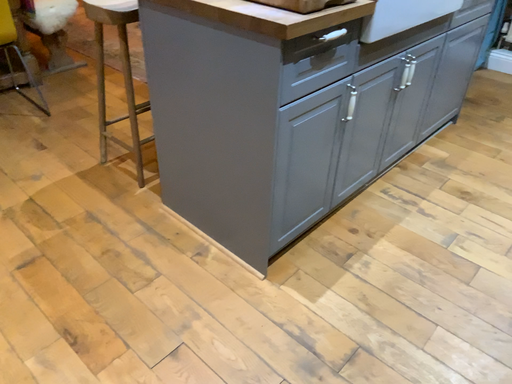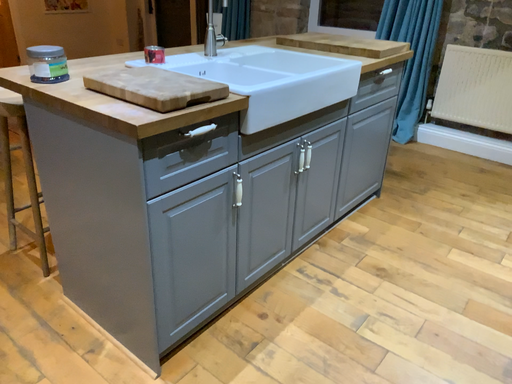
Question: Which way did the camera rotate in the video?

Choices:
 (A) rotated upward
 (B) rotated downward

Answer: (A)